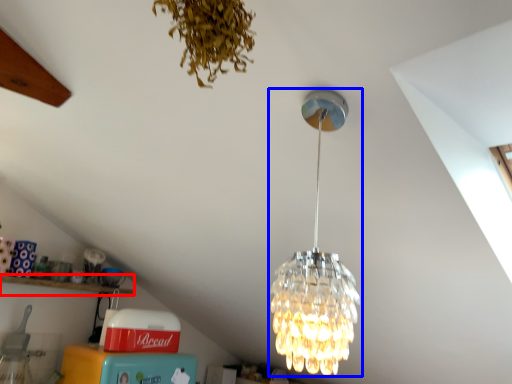
Question: Which of the following is the farthest to the observer, shelf (highlighted by a red box) or lamp (highlighted by a blue box)?

Choices:
 (A) shelf
 (B) lamp

Answer: (A)